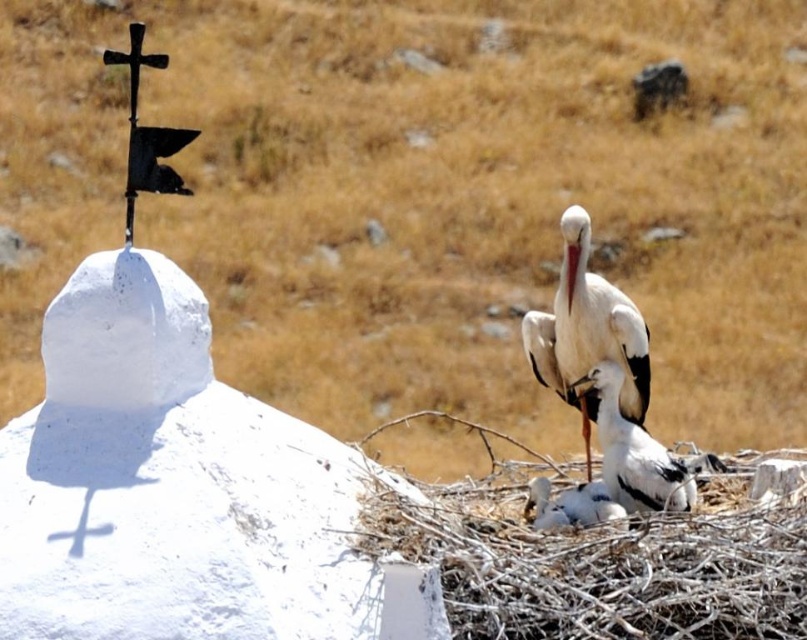
Which of these two, white matte stork at center or white feathered stork at center, stands taller?

Standing taller between the two is white matte stork at center.

Is white matte stork at center shorter than white feathered stork at center?

Incorrect, white matte stork at center's height does not fall short of white feathered stork at center's.

In the scene shown: Measure the distance between white matte stork at center and camera.

white matte stork at center is 4.01 meters from camera.

The width and height of the screenshot is (807, 640). I want to click on white matte stork at center, so click(587, 332).